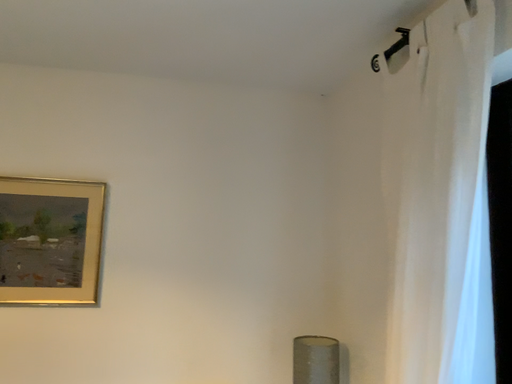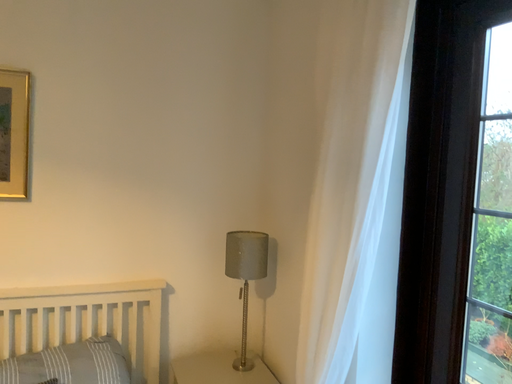
Question: Which way did the camera rotate in the video?

Choices:
 (A) rotated left
 (B) rotated right

Answer: (B)